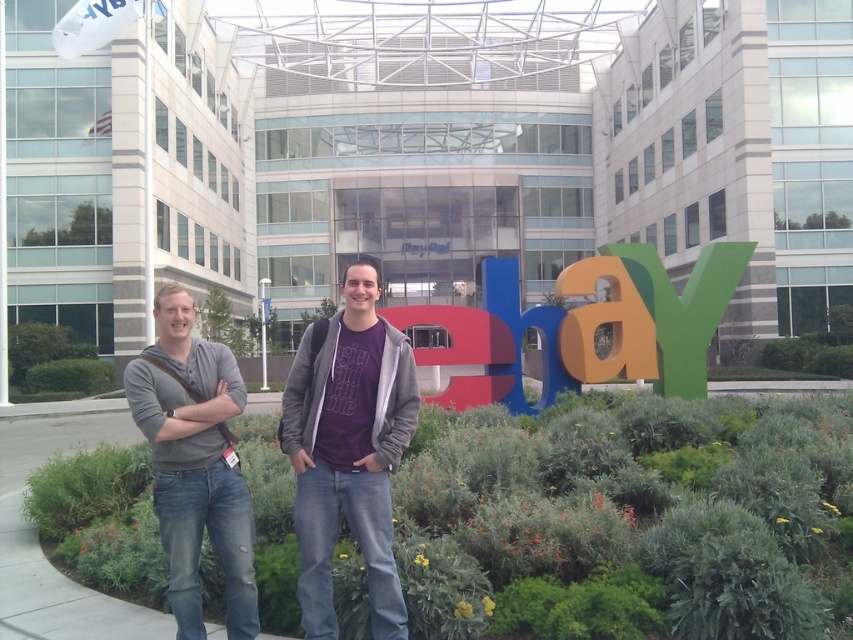
You are standing in front of the eBay sign and want to pick up the gray cotton hoodie at left. Which direction should you move to reach it?

The gray cotton hoodie at left is located at point (x=194, y=464), so you should move to the left to reach it.

You are a delivery person carrying a package that requires a 5 meter clearance to pass through a narrow alley. You need to navigate between the gray cotton hoodie at center and the orange matte letter at center. Is the space between them sufficient for your delivery route?

The distance between the gray cotton hoodie at center and the orange matte letter at center is 6.06 meters, which is more than the required 5 meter clearance. Therefore, the space is sufficient for your delivery route.

You are standing at the entrance of the building and want to reach the point marked as point [334,504]. Which direction should you move relative to point [614,349]?

You should move towards the front of point [614,349] to reach point [334,504] since it is located in front of it.